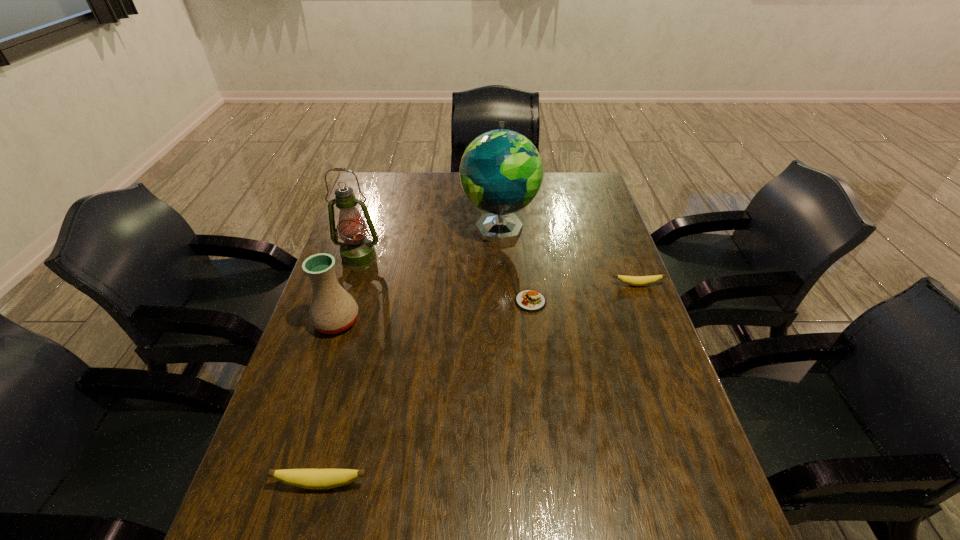
This screenshot has width=960, height=540. What are the coordinates of `the taller banana` in the screenshot? It's located at 318,479.

Find the location of a particular element. the nearest object is located at coordinates click(x=318, y=479).

Find the location of a particular element. This screenshot has width=960, height=540. the rightmost object is located at coordinates (631, 280).

This screenshot has height=540, width=960. What are the coordinates of `the fourth nearest object` in the screenshot? It's located at (631, 280).

At what (x,y) coordinates should I click in order to perform the action: click on globe. Please return your answer as a coordinate pair (x, y). The height and width of the screenshot is (540, 960). Looking at the image, I should click on (501, 171).

This screenshot has width=960, height=540. What are the coordinates of `the third tallest object` in the screenshot? It's located at (332, 310).

The height and width of the screenshot is (540, 960). I want to click on the shortest object, so click(529, 300).

Identify the location of oil lamp. The width and height of the screenshot is (960, 540). (357, 252).

Locate an element on the screen. This screenshot has width=960, height=540. vacant space situated 0.120m on the right of the nearest object is located at coordinates (429, 483).

Image resolution: width=960 pixels, height=540 pixels. I want to click on vacant area situated 0.290m on the left of the shorter banana, so click(x=514, y=285).